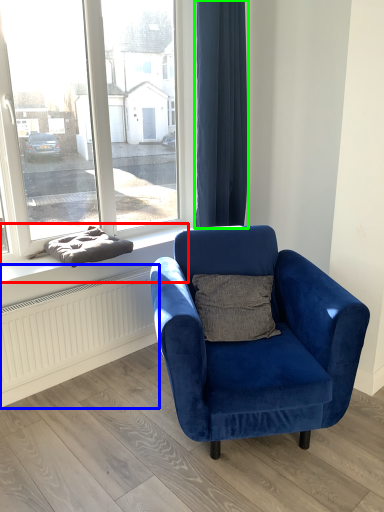
Question: Which object is the farthest from window sill (highlighted by a red box)? Choose among these: radiator (highlighted by a blue box) or curtain (highlighted by a green box).

Choices:
 (A) radiator
 (B) curtain

Answer: (B)